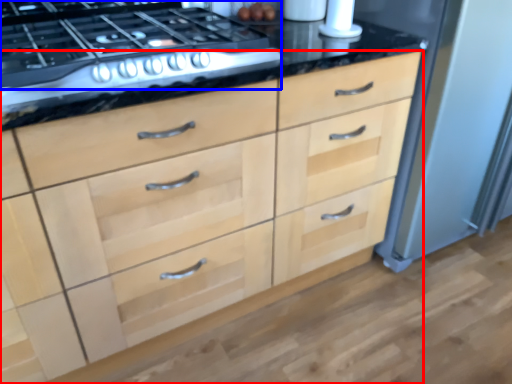
Question: Which object is closer to the camera taking this photo, chest of drawers (highlighted by a red box) or gas stove (highlighted by a blue box)?

Choices:
 (A) chest of drawers
 (B) gas stove

Answer: (A)